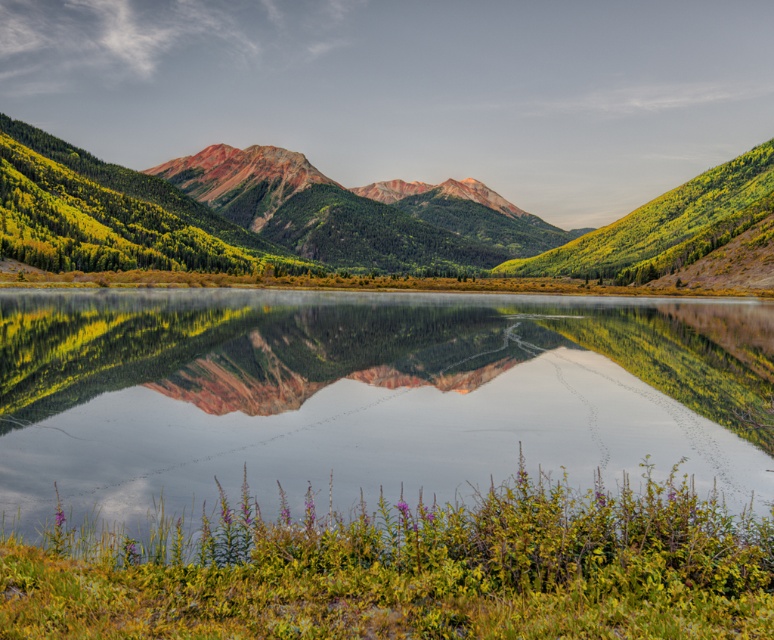
You are standing at the edge of the green grassy shore at lower center and want to take a photo of the matte red rock mountain range at center. Since the mountains are in the background, will they appear larger or smaller in your photo compared to their actual size?

The matte red rock mountain range at center appears smaller in the photo because they are farther away from the green grassy shore at lower center where you are standing.

Looking at the serene mountain landscape with the calm lake, you notice the green grassy shore at lower center and the matte red rock mountain range at center. Which of these two elements takes up more visual space in the image?

The matte red rock mountain range at center occupies more visual space than the green grassy shore at lower center.